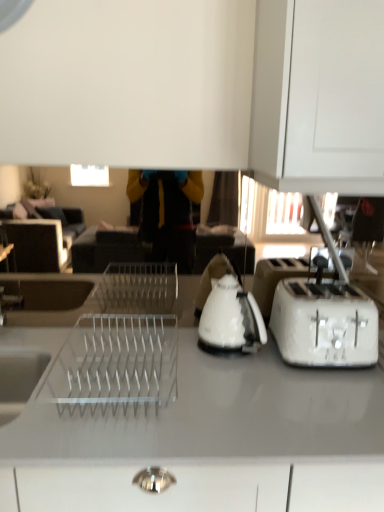
Question: Would you say white plastic toaster at right is a long distance from white glossy kettle at center?

Choices:
 (A) yes
 (B) no

Answer: (B)

Question: Can you confirm if white plastic toaster at right is bigger than white glossy kettle at center?

Choices:
 (A) yes
 (B) no

Answer: (A)

Question: Is white plastic toaster at right with white glossy kettle at center?

Choices:
 (A) yes
 (B) no

Answer: (B)

Question: Is white plastic toaster at right to the right of white glossy kettle at center from the viewer's perspective?

Choices:
 (A) yes
 (B) no

Answer: (A)

Question: From the image's perspective, is white plastic toaster at right on white glossy kettle at center?

Choices:
 (A) yes
 (B) no

Answer: (B)

Question: From a real-world perspective, relative to white glossy countertop at center, is white glossy kettle at center vertically above or below?

Choices:
 (A) above
 (B) below

Answer: (A)

Question: Is white glossy kettle at center in front of or behind white glossy countertop at center in the image?

Choices:
 (A) front
 (B) behind

Answer: (B)

Question: Looking at the image, does white glossy kettle at center seem bigger or smaller compared to white glossy countertop at center?

Choices:
 (A) big
 (B) small

Answer: (B)

Question: From the image's perspective, is white glossy kettle at center above or below white glossy countertop at center?

Choices:
 (A) below
 (B) above

Answer: (B)

Question: In terms of height, does white plastic toaster at right look taller or shorter compared to white glossy kettle at center?

Choices:
 (A) tall
 (B) short

Answer: (B)

Question: Based on their sizes in the image, would you say white plastic toaster at right is bigger or smaller than white glossy kettle at center?

Choices:
 (A) small
 (B) big

Answer: (B)

Question: Based on their positions, is white plastic toaster at right located to the left or right of white glossy kettle at center?

Choices:
 (A) left
 (B) right

Answer: (B)

Question: From a real-world perspective, relative to white glossy kettle at center, is white plastic toaster at right vertically above or below?

Choices:
 (A) above
 (B) below

Answer: (B)

Question: Considering their positions, is white glossy countertop at center located in front of or behind white glossy kettle at center?

Choices:
 (A) front
 (B) behind

Answer: (A)

Question: From a real-world perspective, is white glossy countertop at center positioned above or below white glossy kettle at center?

Choices:
 (A) below
 (B) above

Answer: (A)